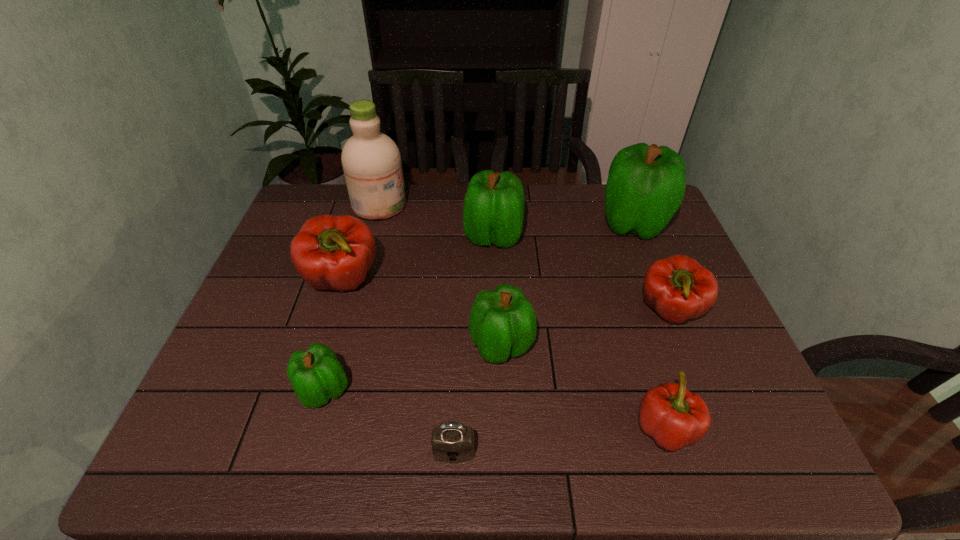
Identify which bell pepper is the sixth closest to the second biggest green bell pepper. Please provide its 2D coordinates. Your answer should be formatted as a tuple, i.e. [(x, y)], where the tuple contains the x and y coordinates of a point satisfying the conditions above.

[(673, 416)]

Locate which green bell pepper is the third closest to the nearest pink bell pepper. Please provide its 2D coordinates. Your answer should be formatted as a tuple, i.e. [(x, y)], where the tuple contains the x and y coordinates of a point satisfying the conditions above.

[(646, 184)]

Point out which green bell pepper is positioned as the fourth nearest to the padlock. Please provide its 2D coordinates. Your answer should be formatted as a tuple, i.e. [(x, y)], where the tuple contains the x and y coordinates of a point satisfying the conditions above.

[(646, 184)]

Point out which pink bell pepper is positioned as the third nearest to the second tallest object. Please provide its 2D coordinates. Your answer should be formatted as a tuple, i.e. [(x, y)], where the tuple contains the x and y coordinates of a point satisfying the conditions above.

[(330, 252)]

This screenshot has width=960, height=540. What are the coordinates of `pink bell pepper that is the second nearest to the third biggest green bell pepper` in the screenshot? It's located at (330, 252).

At what (x,y) coordinates should I click in order to perform the action: click on free point that satisfies the following two spatial constraints: 1. on the back side of the third smallest green bell pepper; 2. on the front label of the tallest object. Please return your answer as a coordinate pair (x, y). Image resolution: width=960 pixels, height=540 pixels. Looking at the image, I should click on (492, 205).